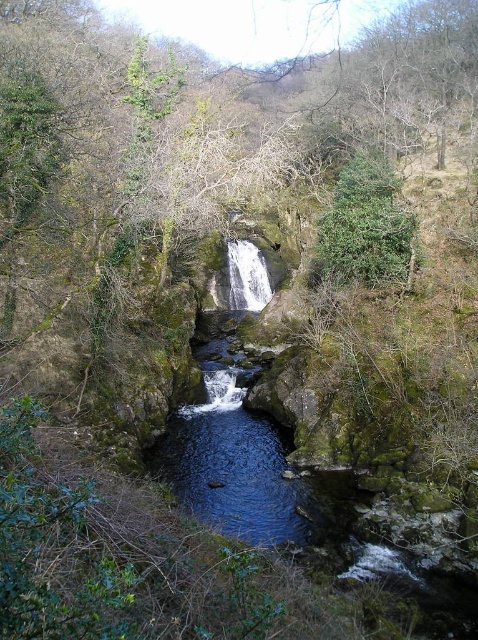
Does dark blue rock at center appear under white textured waterfall at center?

Indeed, dark blue rock at center is positioned under white textured waterfall at center.

Between point (204, 467) and point (258, 262), which one is positioned in front?

Point (204, 467) is in front.

Locate an element on the screen. The width and height of the screenshot is (478, 640). dark blue rock at center is located at coordinates (286, 496).

Is dark blue rock at center above green leafy tree at upper center?

Incorrect, dark blue rock at center is not positioned above green leafy tree at upper center.

Can you confirm if dark blue rock at center is thinner than green leafy tree at upper center?

No, dark blue rock at center is not thinner than green leafy tree at upper center.

At what (x,y) coordinates should I click in order to perform the action: click on dark blue rock at center. Please return your answer as a coordinate pair (x, y). Looking at the image, I should click on (286, 496).

Can you confirm if green leafy tree at upper center is smaller than white textured waterfall at center?

No.

The image size is (478, 640). I want to click on green leafy tree at upper center, so click(366, 227).

Between point (323, 257) and point (238, 282), which one is positioned behind?

Point (238, 282)

Find the location of `green leafy tree at upper center`. green leafy tree at upper center is located at coordinates (366, 227).